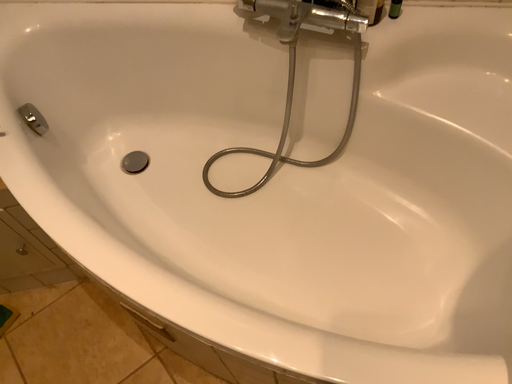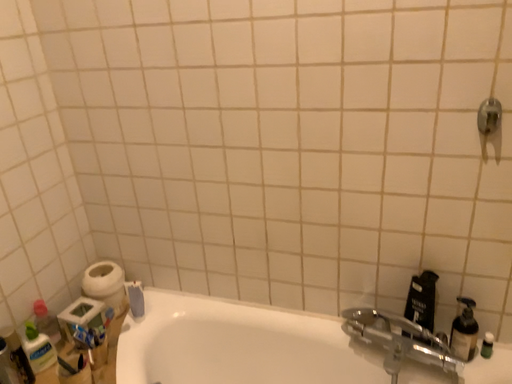
Question: How did the camera likely rotate when shooting the video?

Choices:
 (A) rotated downward
 (B) rotated upward

Answer: (B)